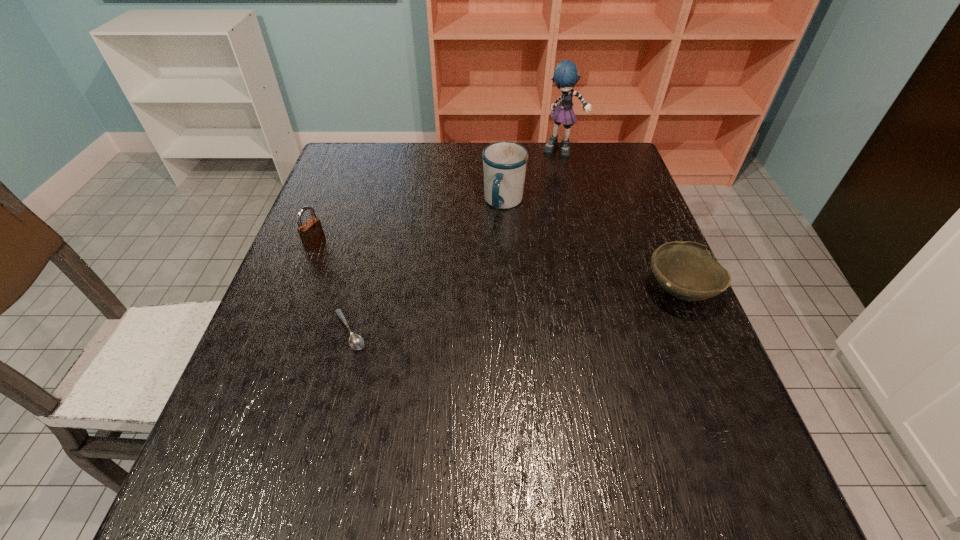
The width and height of the screenshot is (960, 540). What are the coordinates of `vacant space on the desktop that is between the shortest object and the bowl and is positioned on the handle side of the fourth nearest object` in the screenshot? It's located at (475, 315).

Where is `vacant space on the desktop that is between the soupspoon and the bowl and is positioned on the front-facing side of the padlock`? The width and height of the screenshot is (960, 540). vacant space on the desktop that is between the soupspoon and the bowl and is positioned on the front-facing side of the padlock is located at coordinates (491, 313).

Where is `vacant space on the desktop that is between the shortest object and the rightmost object and is positioned on the front-facing side of the rag doll`? The image size is (960, 540). vacant space on the desktop that is between the shortest object and the rightmost object and is positioned on the front-facing side of the rag doll is located at coordinates (550, 306).